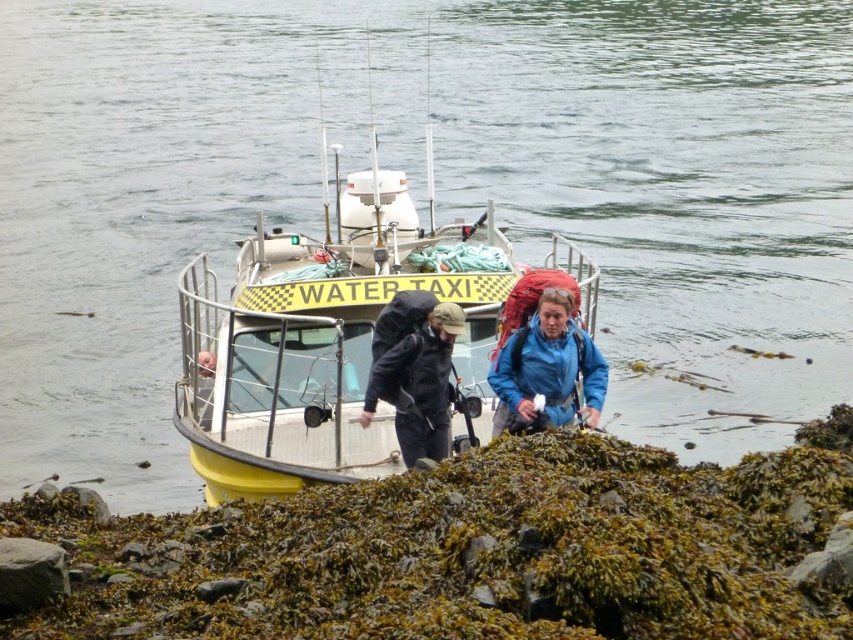
Consider the image. Between yellow matte water taxi at center and black matte backpack at center, which one has less height?

Standing shorter between the two is black matte backpack at center.

Who is positioned more to the left, yellow matte water taxi at center or black matte backpack at center?

yellow matte water taxi at center

Who is more forward, (320, 456) or (405, 454)?

Positioned in front is point (320, 456).

Identify the location of yellow matte water taxi at center. (338, 332).

Can you confirm if black matte backpack at center is thinner than blue matte jacket at center?

Indeed, black matte backpack at center has a lesser width compared to blue matte jacket at center.

Does black matte backpack at center come in front of blue matte jacket at center?

Yes, it is in front of blue matte jacket at center.

Locate an element on the screen. This screenshot has height=640, width=853. black matte backpack at center is located at coordinates (415, 371).

Is blue fabric backpack at center below blue matte jacket at center?

Yes, blue fabric backpack at center is below blue matte jacket at center.

Which is in front, point (450, 356) or point (577, 348)?

Point (450, 356) is in front.

Does point (439, 310) lie in front of point (560, 324)?

Yes, it is in front of point (560, 324).

Where is `blue fabric backpack at center`? This screenshot has height=640, width=853. blue fabric backpack at center is located at coordinates (415, 372).